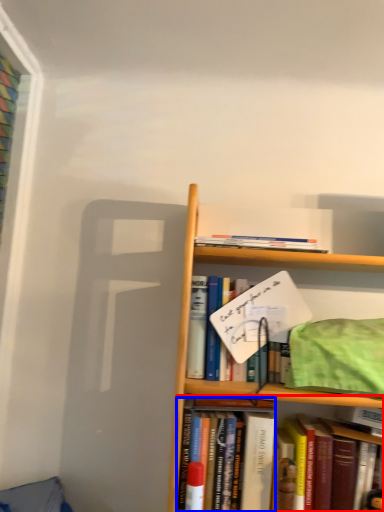
Question: Which of the following is the farthest to the observer, book (highlighted by a red box) or book (highlighted by a blue box)?

Choices:
 (A) book
 (B) book

Answer: (B)